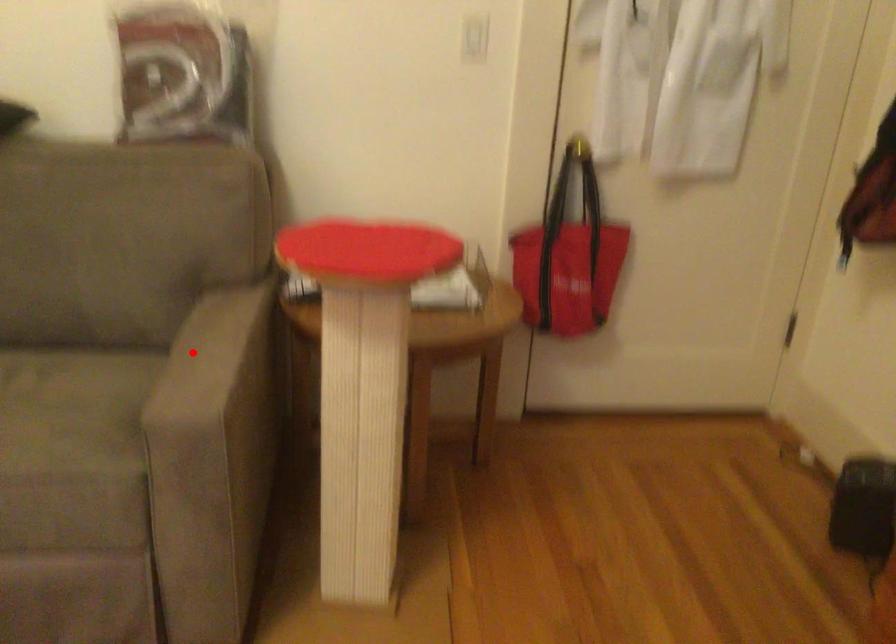
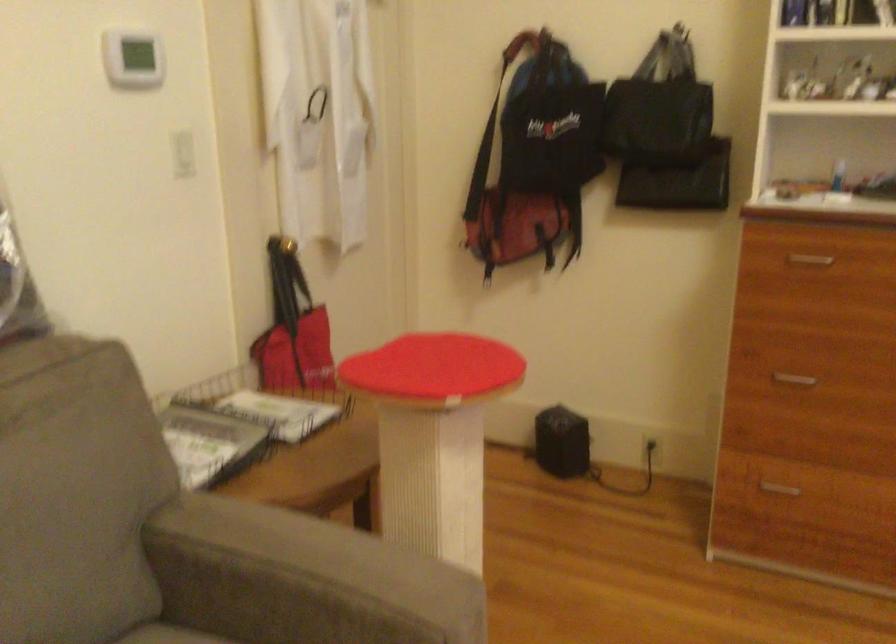
Question: I am providing you with two images of the same scene from different viewpoints. Given a red point in image1, look at the same physical point in image2. Is it:

Choices:
 (A) Closer to the viewpoint
 (B) Farther from the viewpoint

Answer: (A)